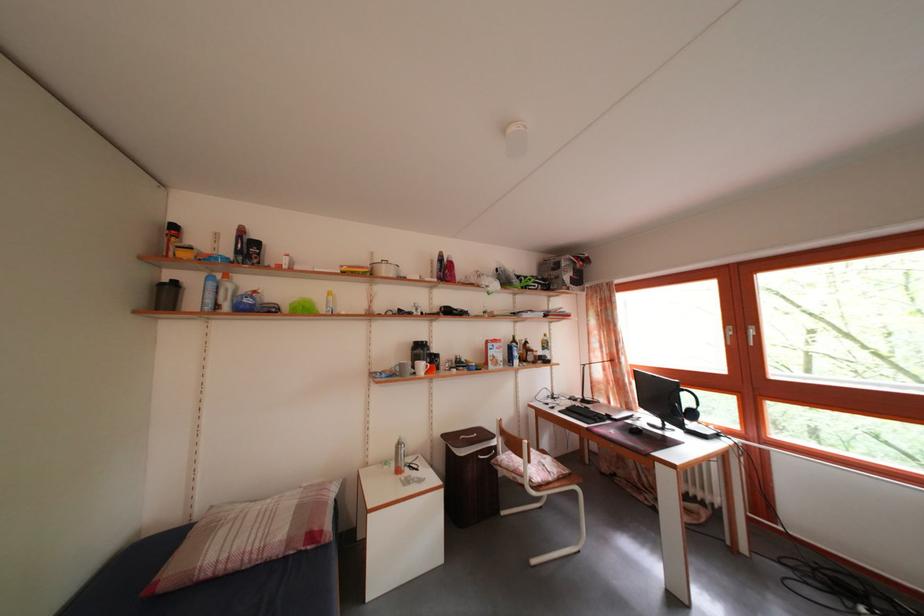
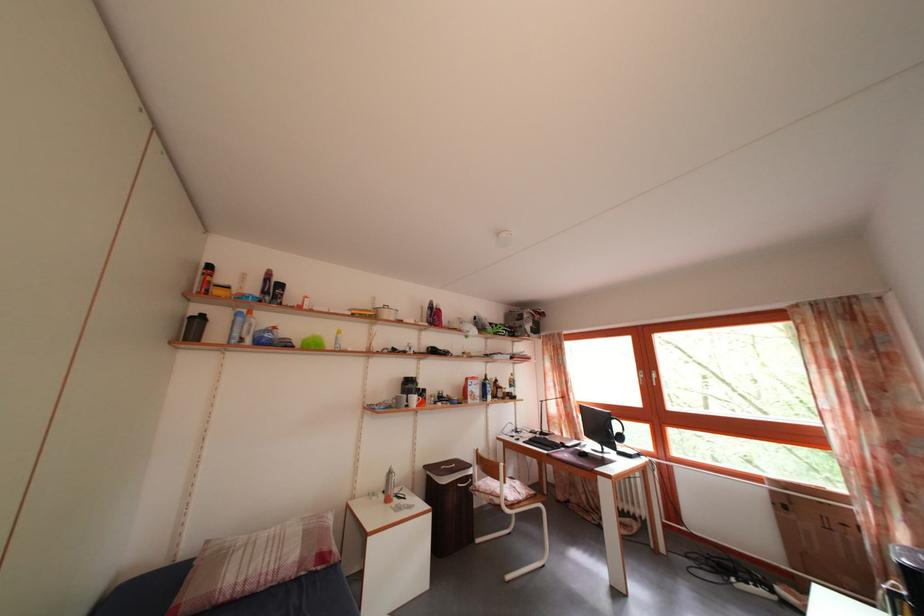
Locate, in the second image, the point that corresponds to pixel 695 408 in the first image.

(624, 434)